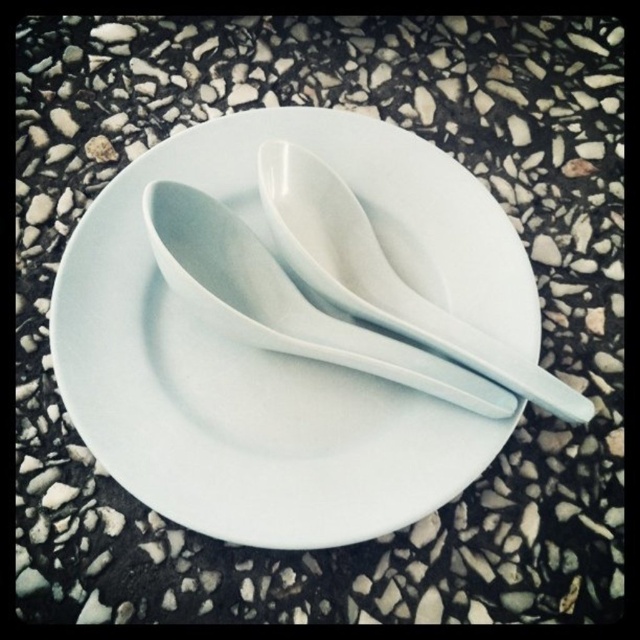
You are arranging items on a table and need to place a new object near the white ceramic saucer at center. If the table is represented on a coordinate grid where the bottom left corner is the origin, what are the coordinates of the saucer to help you position the new item?

The white ceramic saucer at center is located at coordinates point (x=280, y=355), so you can use these coordinates to position the new item near it.

You are arranging a tea set on a table. The white ceramic saucer at center and the white glossy spoon at center are part of the set. Which object should you place first if you want to ensure there is enough space for both items?

The white ceramic saucer at center should be placed first because it is larger than the white glossy spoon at center, ensuring there is enough space for both items.

You are holding a camera and want to take a closeup shot of the white ceramic saucer at center. Based on the scene description, is the saucer currently positioned at a distance that allows for a clear closeup without needing to move it closer?

The white ceramic saucer at center is 38.17 inches away from camera. Since 38.17 inches is approximately 0.97 meters, which is a reasonable distance for a closeup shot, the saucer is already positioned at a suitable distance for a clear closeup without needing to move it closer.